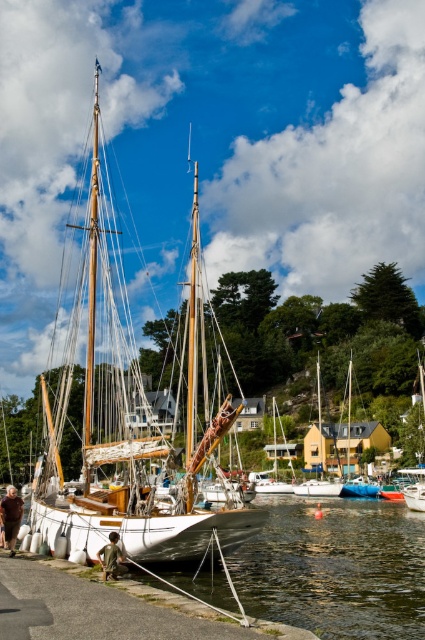
You are a dock worker who needs to move the blue rubber dinghy at center to another dock. Can you move it without moving the white polished wood sailboat at center first?

The white polished wood sailboat at center is positioned over the blue rubber dinghy at center, so you must move the sailboat first to access the dinghy.

You are a sailor planning to board the white polished wood sailboat at center and the white wooden sailboat at center. Which one is positioned higher in the scene?

The white polished wood sailboat at center is located above the white wooden sailboat at center, so it is positioned higher in the scene.

You are navigating a small boat in the harbor and need to dock near the white polished wood sailboat at center. Based on its position at coordinates 0.653, 0.296, can you estimate where to position your boat to be directly in front of it?

The white polished wood sailboat at center is located at point (125, 417), so you should position your boat slightly to the right and lower down relative to those coordinates to be directly in front of it.